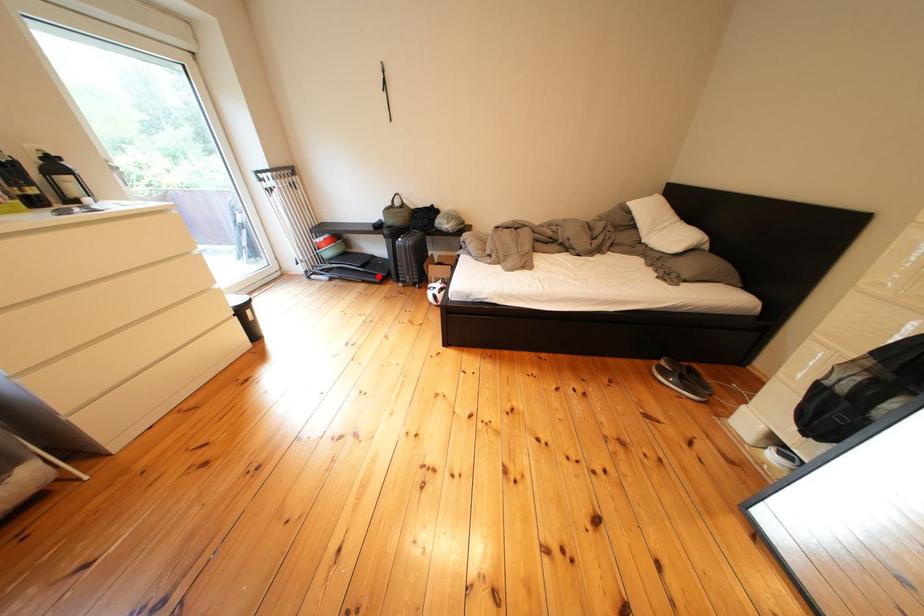
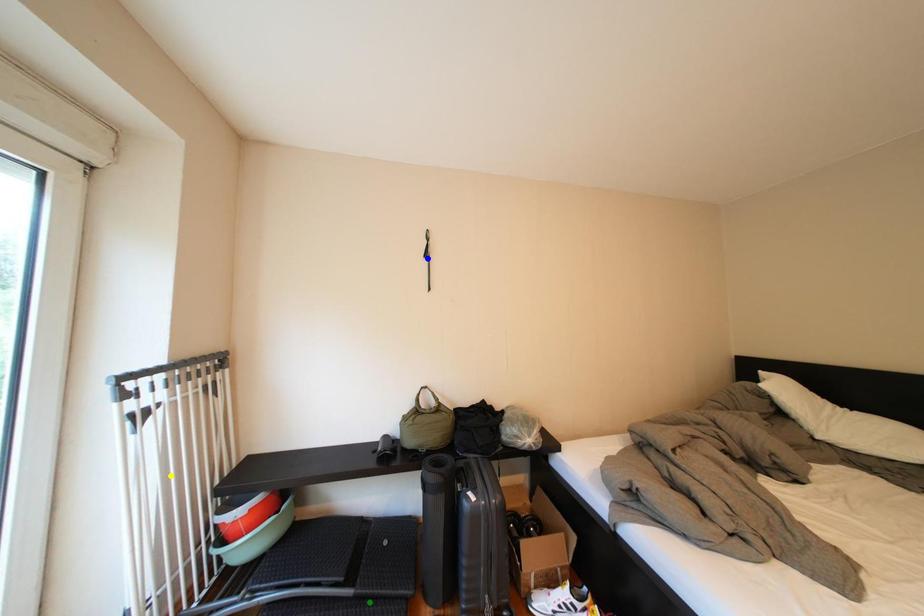
Question: I am providing you with two images of the same scene from different viewpoints. A red point is marked on the first image. You are given multiple points on the second image. In image 2, which mark is for the same physical point as the one in image 1?

Choices:
 (A) green point
 (B) yellow point
 (C) blue point

Answer: (A)